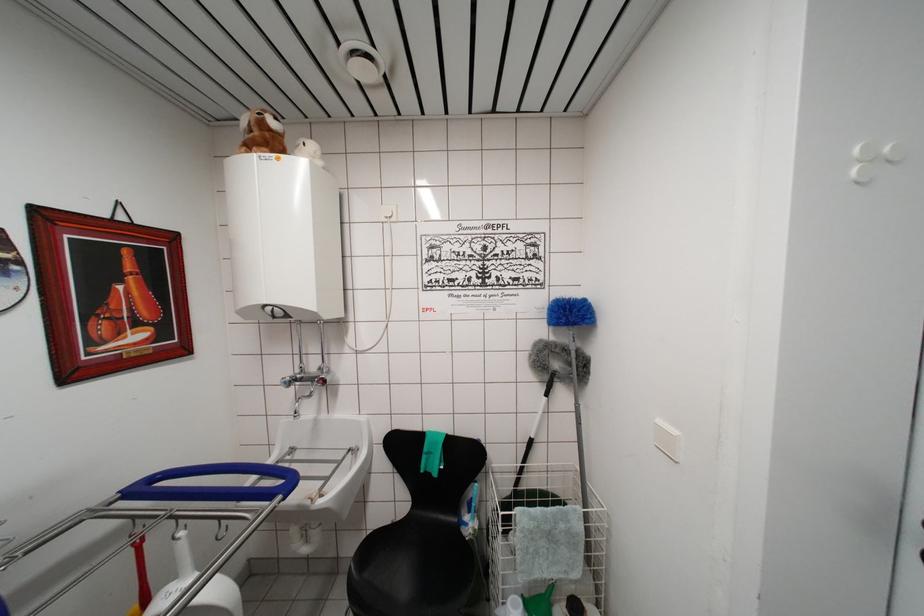
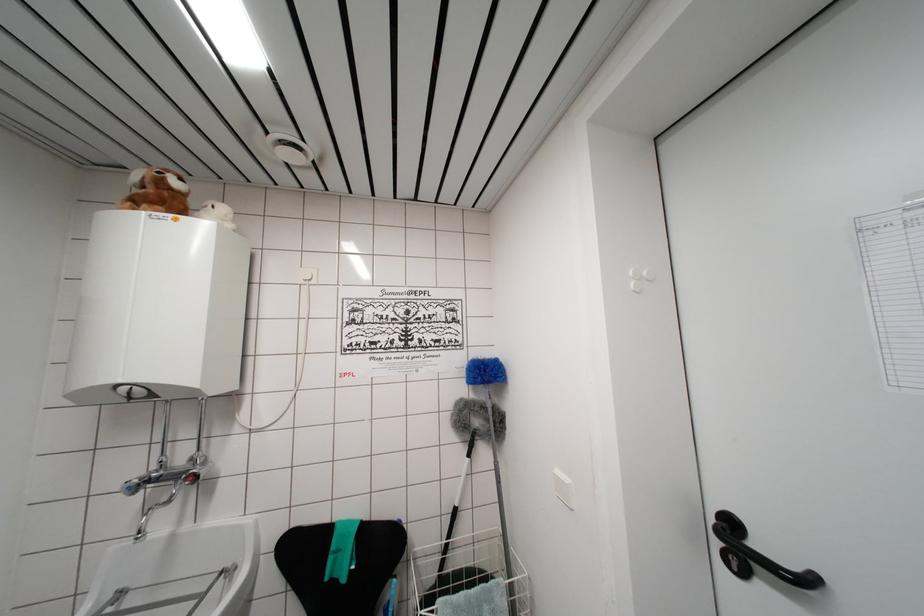
Find the pixel in the second image that matches (324,382) in the first image.

(197, 476)